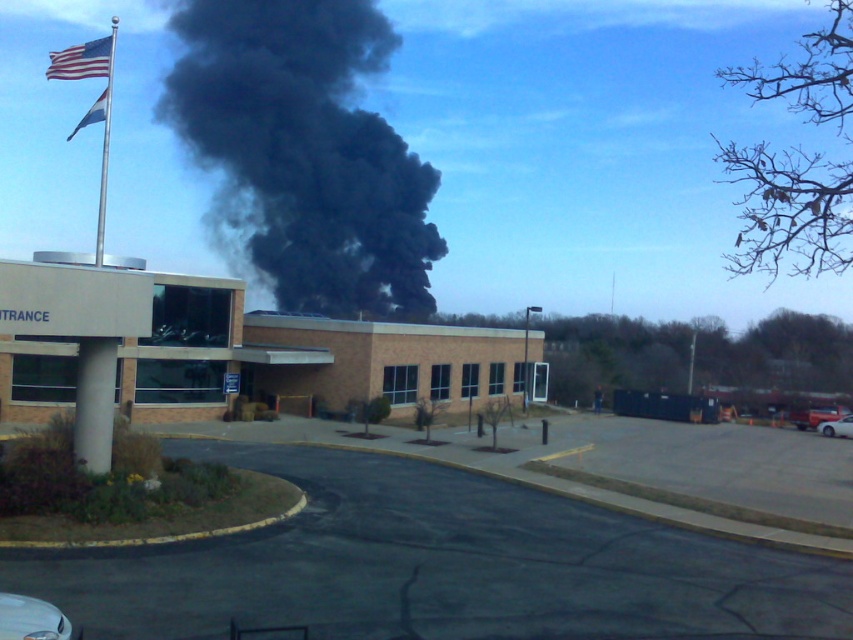
You are a firefighter assessing the situation from a safe distance. You notice the black smoke at upper center and the american flag at upper left. Which object appears taller in the image?

The black smoke at upper center appears taller than the american flag at upper left because the black smoke at upper center has a greater height compared to the american flag at upper left.

You are a firefighter assessing the scene from a safe distance. You see the black smoke at upper center and the american flag at upper left. How far apart are these two objects?

The distance between the black smoke at upper center and the american flag at upper left is 51.40 meters.

You are standing in front of the building and want to walk from point (368, 177) to point (67, 61). Which direction should you move?

You should move towards the bottom left direction because point (368, 177) is further to the camera than point (67, 61), so moving towards the bottom left will bring you closer to the latter point.